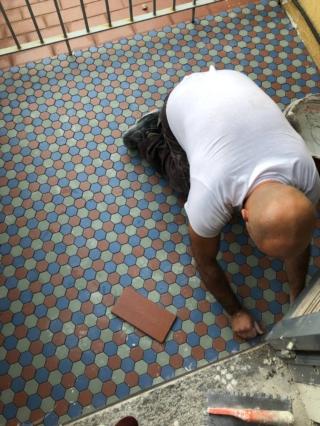
Identify the location of floor. (98, 203).